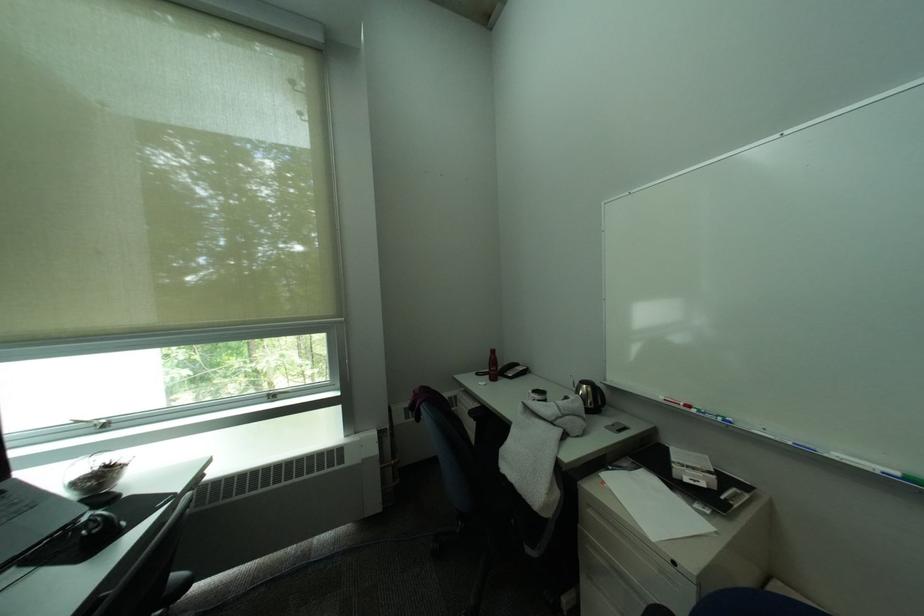
What do you see at coordinates (99, 529) in the screenshot?
I see `the black kettle handle` at bounding box center [99, 529].